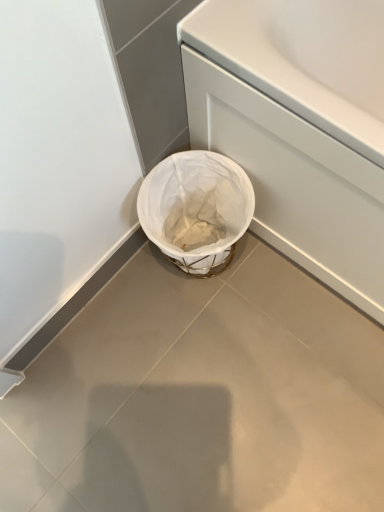
Question: Is white fabric basket at lower center outside white matte bath at lower right?

Choices:
 (A) no
 (B) yes

Answer: (B)

Question: Does white fabric basket at lower center have a larger size compared to white matte bath at lower right?

Choices:
 (A) yes
 (B) no

Answer: (B)

Question: Considering the relative sizes of white fabric basket at lower center and white matte bath at lower right in the image provided, is white fabric basket at lower center thinner than white matte bath at lower right?

Choices:
 (A) yes
 (B) no

Answer: (B)

Question: Can you confirm if white fabric basket at lower center is positioned to the left of white matte bath at lower right?

Choices:
 (A) no
 (B) yes

Answer: (B)

Question: From the image's perspective, is white fabric basket at lower center over white matte bath at lower right?

Choices:
 (A) no
 (B) yes

Answer: (A)

Question: Considering the positions of point (243, 181) and point (263, 344), is point (243, 181) closer or farther from the camera than point (263, 344)?

Choices:
 (A) closer
 (B) farther

Answer: (A)

Question: In terms of width, does white fabric basket at lower center look wider or thinner when compared to white fabric basket at lower center?

Choices:
 (A) thin
 (B) wide

Answer: (A)

Question: Do you think white fabric basket at lower center is within white fabric basket at lower center, or outside of it?

Choices:
 (A) inside
 (B) outside

Answer: (B)

Question: From a real-world perspective, relative to white fabric basket at lower center, is white fabric basket at lower center vertically above or below?

Choices:
 (A) below
 (B) above

Answer: (B)

Question: Is white matte bath at lower right to the left or to the right of white fabric basket at lower center in the image?

Choices:
 (A) left
 (B) right

Answer: (B)

Question: From a real-world perspective, is white matte bath at lower right above or below white fabric basket at lower center?

Choices:
 (A) below
 (B) above

Answer: (B)

Question: In terms of height, does white matte bath at lower right look taller or shorter compared to white fabric basket at lower center?

Choices:
 (A) tall
 (B) short

Answer: (A)

Question: Considering the positions of white matte bath at lower right and white fabric basket at lower center in the image, is white matte bath at lower right wider or thinner than white fabric basket at lower center?

Choices:
 (A) wide
 (B) thin

Answer: (A)

Question: Is point (173, 187) closer or farther from the camera than point (240, 142)?

Choices:
 (A) closer
 (B) farther

Answer: (B)

Question: Is white fabric basket at lower center taller or shorter than white matte bath at lower right?

Choices:
 (A) short
 (B) tall

Answer: (A)